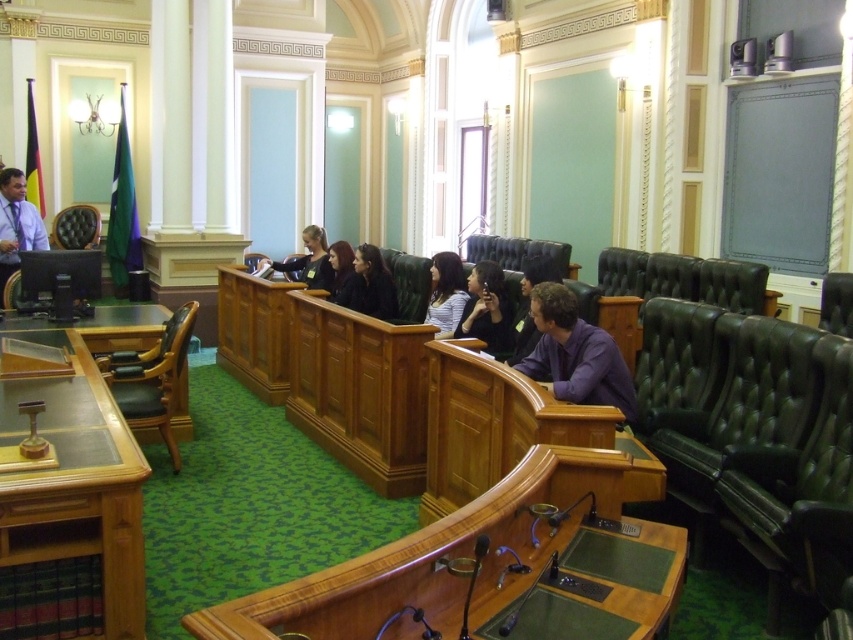
You are a visitor in the meeting room and need to sit down. You see a brown leather chair at left and a matte black jacket at center. Which object is closer to the left wall?

The brown leather chair at left is closer to the left wall since it is positioned on the left side of the matte black jacket at center.

You are standing at the entrance of the legislative chamber and need to locate the brown leather chair at left. According to the room layout, where would you find it?

The brown leather chair at left is located at coordinates point (151, 378) in the room layout.

You are sitting in the green leather chair at center and want to move to the green leather chair at right. Which direction should you move in?

You should move to the right because the green leather chair at center is to the left of the green leather chair at right.